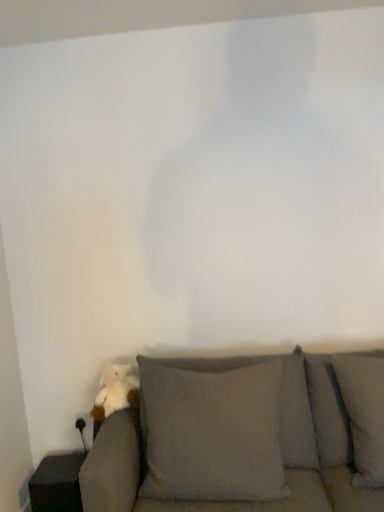
Question: Is white plush toy at lower left smaller than gray fabric couch at lower left?

Choices:
 (A) yes
 (B) no

Answer: (A)

Question: Can you confirm if white plush toy at lower left is bigger than gray fabric couch at lower left?

Choices:
 (A) no
 (B) yes

Answer: (A)

Question: Would you say white plush toy at lower left contains gray fabric couch at lower left?

Choices:
 (A) yes
 (B) no

Answer: (B)

Question: Can you confirm if white plush toy at lower left is shorter than gray fabric couch at lower left?

Choices:
 (A) no
 (B) yes

Answer: (B)

Question: Is white plush toy at lower left in contact with gray fabric couch at lower left?

Choices:
 (A) yes
 (B) no

Answer: (B)

Question: From a real-world perspective, is white plush toy at lower left located higher than gray fabric couch at lower left?

Choices:
 (A) yes
 (B) no

Answer: (A)

Question: Is the position of gray fabric couch at lower left more distant than that of white plush toy at lower left?

Choices:
 (A) no
 (B) yes

Answer: (A)

Question: From a real-world perspective, is gray fabric couch at lower left on top of white plush toy at lower left?

Choices:
 (A) yes
 (B) no

Answer: (B)

Question: From the image's perspective, is gray fabric couch at lower left under white plush toy at lower left?

Choices:
 (A) no
 (B) yes

Answer: (B)

Question: Considering the relative positions of gray fabric couch at lower left and white plush toy at lower left in the image provided, is gray fabric couch at lower left to the right of white plush toy at lower left from the viewer's perspective?

Choices:
 (A) no
 (B) yes

Answer: (B)

Question: Does gray fabric couch at lower left have a lesser width compared to white plush toy at lower left?

Choices:
 (A) yes
 (B) no

Answer: (B)

Question: Is the position of gray fabric couch at lower left less distant than that of white plush toy at lower left?

Choices:
 (A) yes
 (B) no

Answer: (A)

Question: Is point (339, 493) closer or farther from the camera than point (122, 367)?

Choices:
 (A) closer
 (B) farther

Answer: (A)